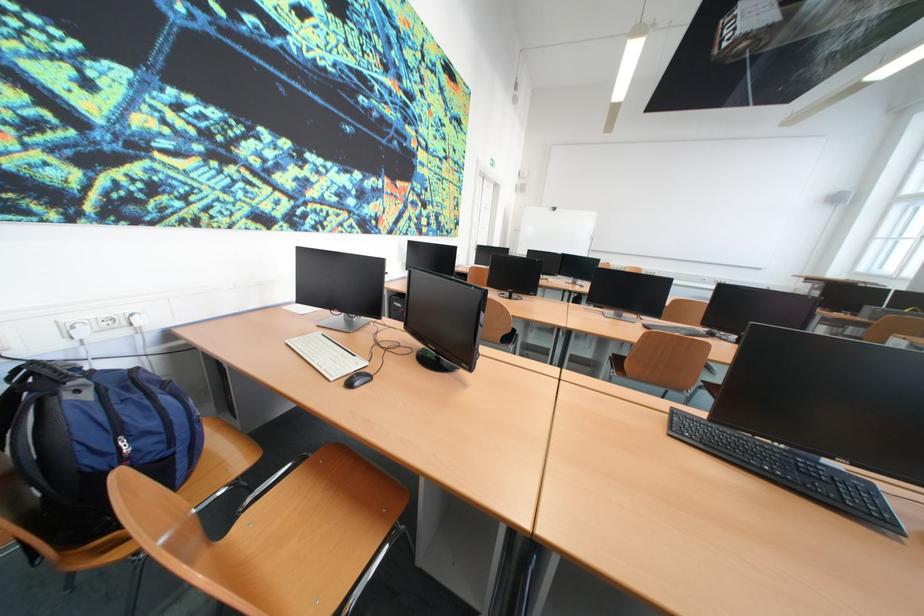
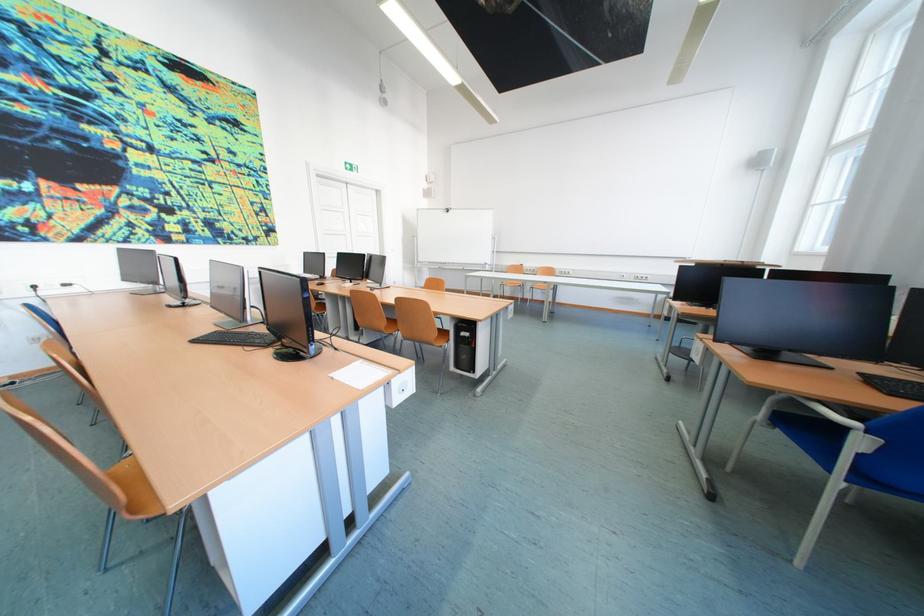
Question: What movement of the cameraman would produce the second image?

Choices:
 (A) Left
 (B) Right
 (C) Forward
 (D) Backward

Answer: (B)